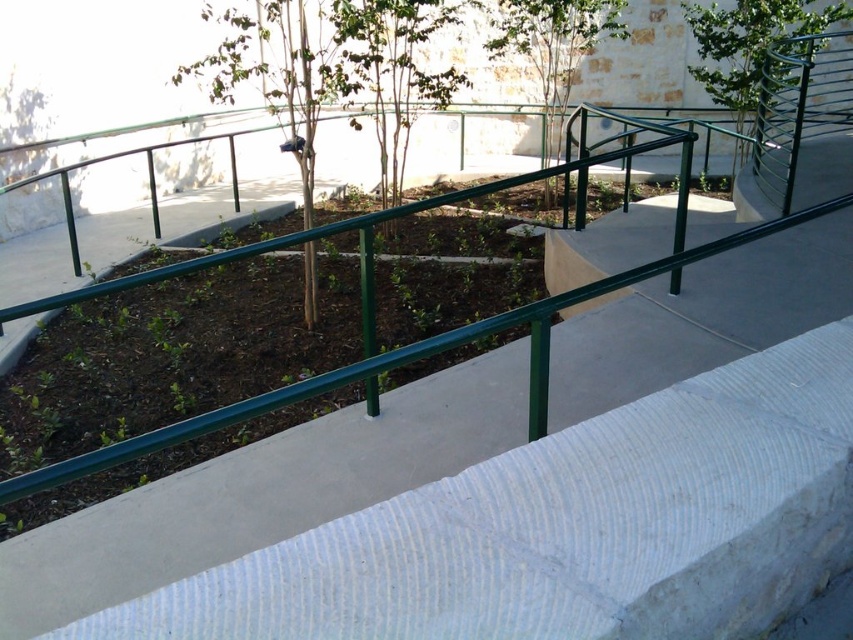
In the scene shown: Is green textured tree at center to the right of green metal tree at upper right from the viewer's perspective?

No, green textured tree at center is not to the right of green metal tree at upper right.

Between green textured tree at center and green metal tree at upper right, which one has more height?

green textured tree at center

Is point (558, 22) farther from camera compared to point (714, 86)?

No, it is not.

Image resolution: width=853 pixels, height=640 pixels. I want to click on green textured tree at center, so click(x=552, y=45).

Is green leafy tree at center further to camera compared to green textured tree at center?

No, it is not.

Can you confirm if green leafy tree at center is smaller than green textured tree at center?

Correct, green leafy tree at center occupies less space than green textured tree at center.

Who is more distant from viewer, [381,3] or [555,134]?

The point [555,134] is behind.

Locate an element on the screen. The height and width of the screenshot is (640, 853). green leafy tree at center is located at coordinates (392, 72).

Does green matte tree at center appear over green metal tree at upper right?

Incorrect, green matte tree at center is not positioned above green metal tree at upper right.

Between green matte tree at center and green metal tree at upper right, which one is positioned lower?

green matte tree at center is below.

Who is more distant from viewer, [305,113] or [821,19]?

Positioned behind is point [821,19].

This screenshot has height=640, width=853. Find the location of `green matte tree at center`. green matte tree at center is located at coordinates (279, 72).